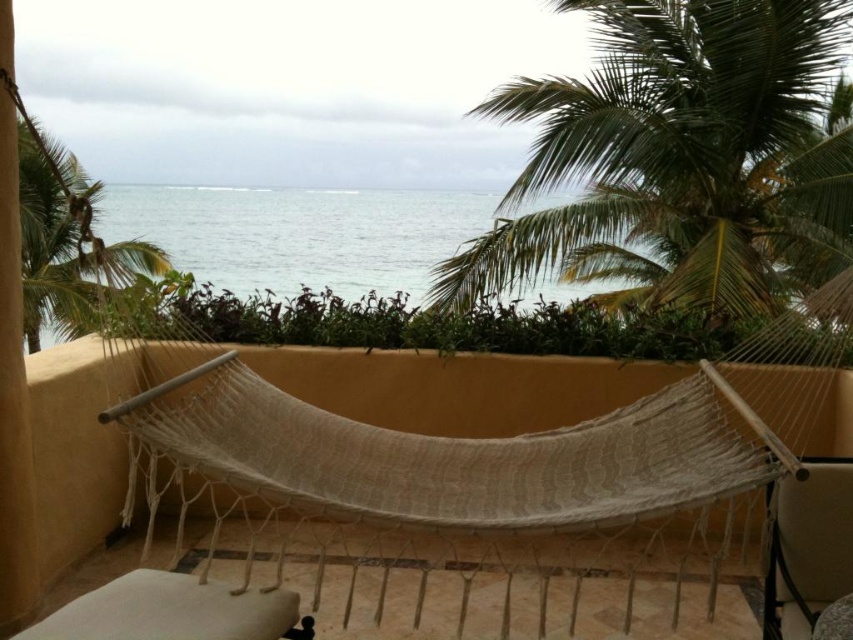
You are standing on the balcony and want to place a small potted plant exactly at the center of the balcony. The green leafy palm tree at upper left is located at coordinate point 0.398, 0.060. Can you determine if the potted plant will be closer to the edge or the center of the balcony?

The green leafy palm tree at upper left is located at coordinate point (x=50, y=253), which is near the upper left corner of the balcony. Since the potted plant will be placed at the center, it will be closer to the center than the edge.

You are standing on the balcony and want to place a small potted plant between the two points labeled point [624,38] and point [36,316]. Which point should the plant be closer to so it is in front of the other point?

The plant should be placed closer to point [624,38] because it is in front of point [36,316].

You are standing on the balcony and want to place a small potted plant exactly at the center of the balcony. The green leafy palm tree at upper right is located at coordinates 0.248, 0.801. Can you determine if the palm tree is closer to the top edge or the right edge of the balcony?

The green leafy palm tree at upper right is located at coordinates (x=682, y=157). Since the y coordinate 0.801 is closer to 1.0 than the x coordinate 0.248 is to 1.0, the palm tree is closer to the top edge of the balcony.